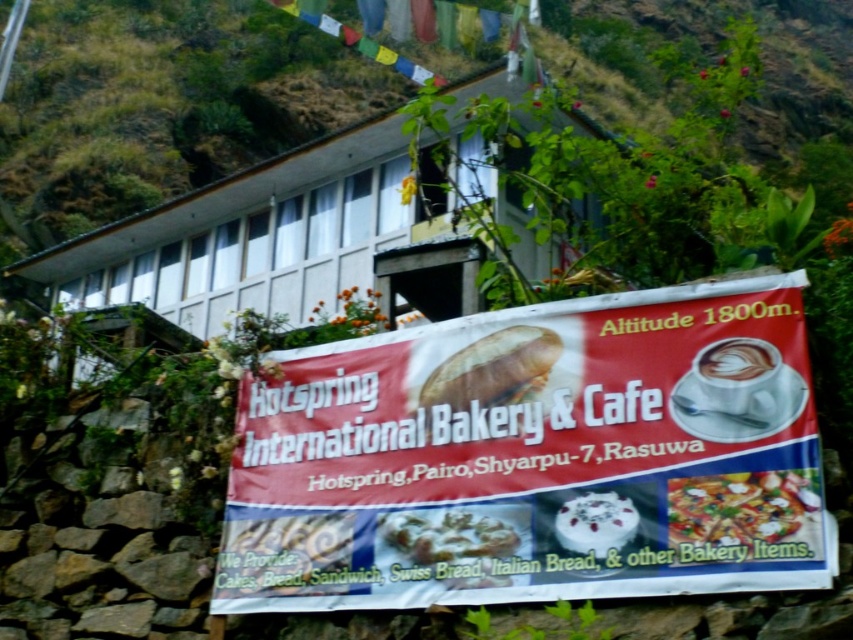
Who is positioned more to the left, white matte swiss bread at center or white frothy coffee at center?

From the viewer's perspective, white matte swiss bread at center appears more on the left side.

Looking at this image, is white matte swiss bread at center below white frothy coffee at center?

Indeed, white matte swiss bread at center is positioned under white frothy coffee at center.

Who is more forward, (469, 524) or (737, 410)?

Point (737, 410)

Find the location of a particular element. This screenshot has width=853, height=640. white matte swiss bread at center is located at coordinates point(451,545).

Is the position of cheesy pizza at center less distant than that of matte white bread at center?

Yes, it is.

Image resolution: width=853 pixels, height=640 pixels. What do you see at coordinates (741, 515) in the screenshot? I see `cheesy pizza at center` at bounding box center [741, 515].

This screenshot has height=640, width=853. Describe the element at coordinates (741, 515) in the screenshot. I see `cheesy pizza at center` at that location.

I want to click on cheesy pizza at center, so click(741, 515).

Can you confirm if white paper banner at center is positioned above white frothy coffee at center?

No.

Is point (469, 595) closer to viewer compared to point (718, 356)?

No, (469, 595) is further to viewer.

Identify the location of white paper banner at center. This screenshot has width=853, height=640. (525, 460).